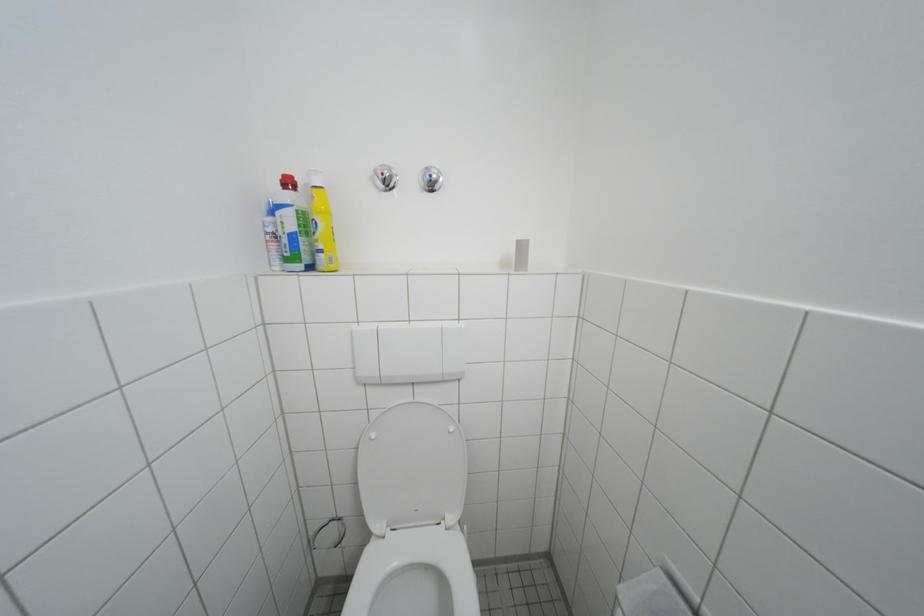
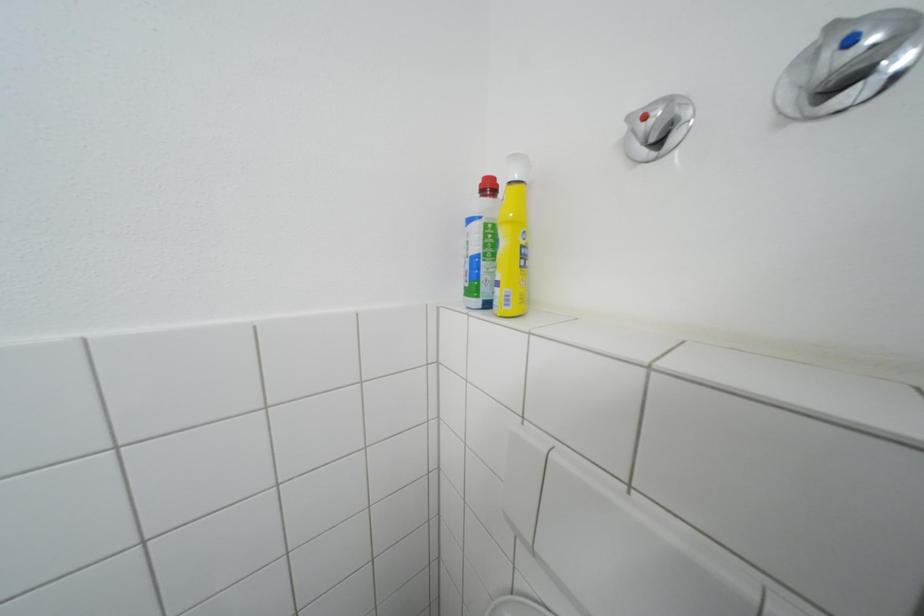
Question: Based on the continuous images, in which direction is the camera rotating? Reply with the corresponding letter.

Choices:
 (A) Left
 (B) Right
 (C) Up
 (D) Down

Answer: (A)